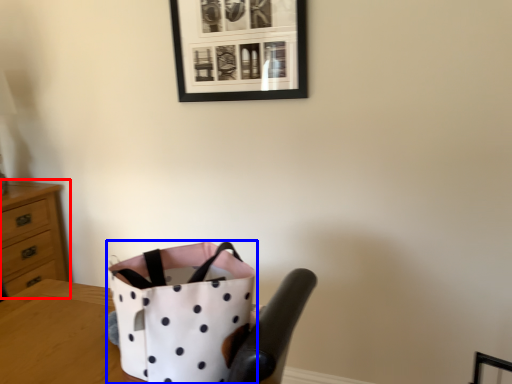
Question: Which object is closer to the camera taking this photo, chest of drawers (highlighted by a red box) or handbag (highlighted by a blue box)?

Choices:
 (A) chest of drawers
 (B) handbag

Answer: (B)